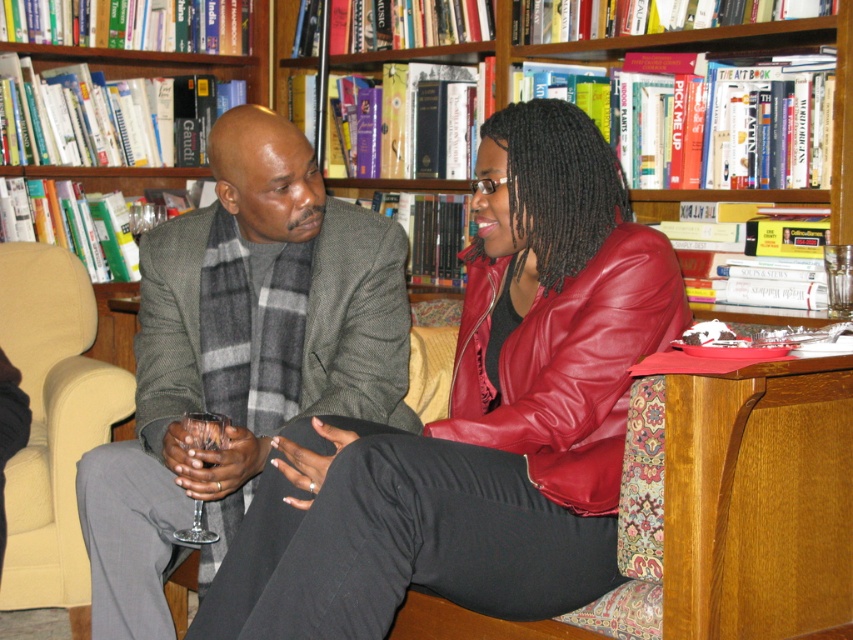
You are a visitor in the room and want to move from the beige fabric armchair at left to the wooden bookcase at upper center. Which object will you encounter first as you move towards the bookcase?

You will encounter the beige fabric armchair at left first because it is closer to you than the wooden bookcase at upper center, which is further away.

You are trying to move a large potted plant that is 1.2 meters wide into the space between the beige fabric armchair at left and the wooden bookcase at upper center. Based on their widths, will the plant fit?

The beige fabric armchair at left is thinner than the wooden bookcase at upper center, but the combined width of both objects is not provided. Therefore, it is impossible to determine if the plant will fit without additional information about their total width.